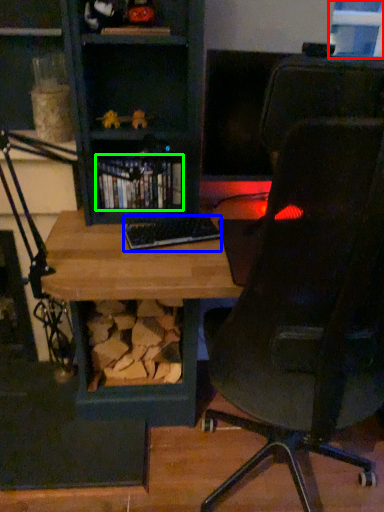
Question: Considering the real-world distances, which object is closest to window (highlighted by a red box)? keyboard (highlighted by a blue box) or book (highlighted by a green box).

Choices:
 (A) keyboard
 (B) book

Answer: (B)